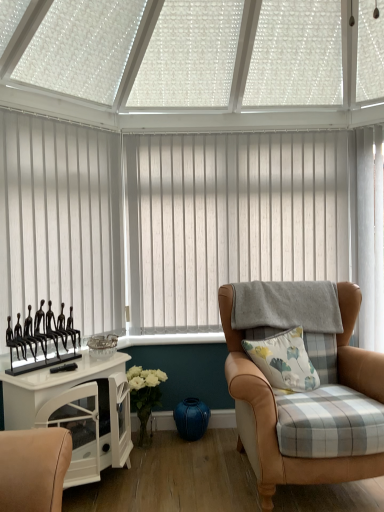
Where is `empty space that is ontop of white vertical blinds at center, the first window blind in the back-to-front sequence (from a real-world perspective)`? The height and width of the screenshot is (512, 384). empty space that is ontop of white vertical blinds at center, the first window blind in the back-to-front sequence (from a real-world perspective) is located at coordinates (240, 125).